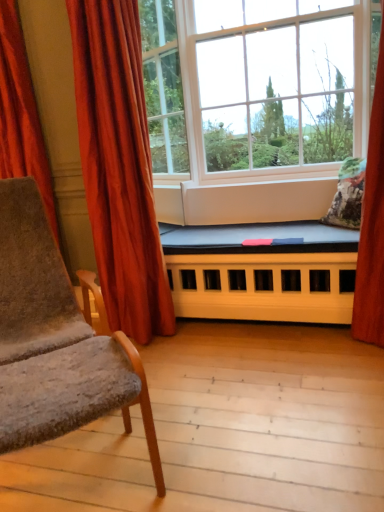
Question: From the image's perspective, is velvet red curtain at left, the second curtain in the left-to-right sequence, located above or below velvet red curtain at left, placed as the 2th curtain when sorted from right to left?

Choices:
 (A) above
 (B) below

Answer: (B)

Question: Is velvet red curtain at left, the second curtain in the left-to-right sequence, wider or thinner than velvet red curtain at left, placed as the 2th curtain when sorted from right to left?

Choices:
 (A) wide
 (B) thin

Answer: (A)

Question: Considering the real-world distances, which object is closest to the velvet gray armchair at left?

Choices:
 (A) clear glass window at center, marked as the 1th window in a left-to-right arrangement
 (B) velvet red curtain at left, which is counted as the 1th curtain, starting from the left
 (C) white plastic window at center, the second window in the left-to-right sequence
 (D) black fabric bed at center
 (E) velvet red curtain at left, which is counted as the first curtain, starting from the right

Answer: (E)

Question: Which object is the farthest from the clear glass window at center, marked as the 2th window in a right-to-left arrangement?

Choices:
 (A) velvet red curtain at left, placed as the 2th curtain when sorted from right to left
 (B) velvet red curtain at left, the second curtain in the left-to-right sequence
 (C) velvet gray armchair at left
 (D) fluffy floral pillow at right
 (E) black fabric bed at center

Answer: (C)